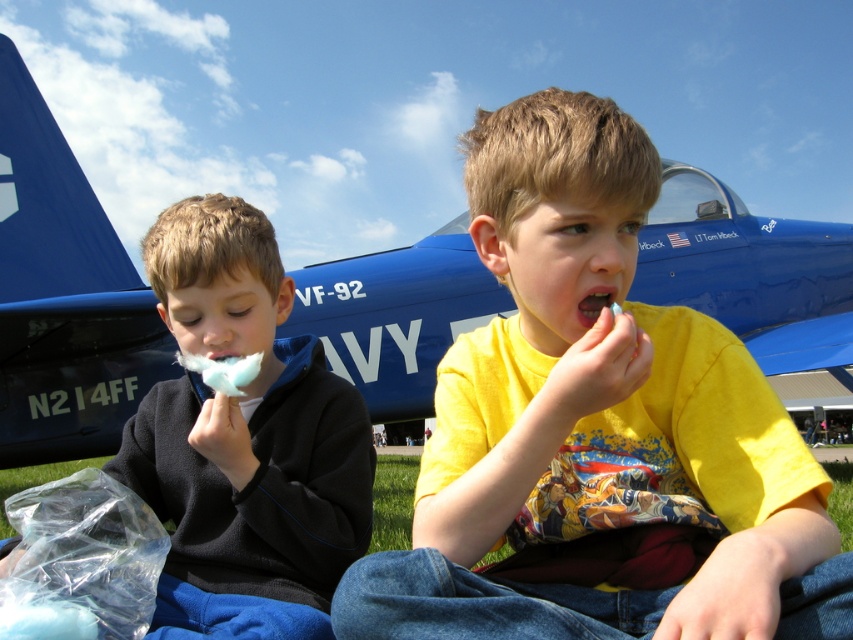
You are a photographer trying to capture a photo of the blue glossy airplane at center and the white fluffy cotton candy at left. From the perspective of the photographer, which object is located to the right?

The blue glossy airplane at center is positioned on the right side of the white fluffy cotton candy at left, so from the photographer perspective, the blue glossy airplane at center is to the right of the white fluffy cotton candy at left.

You are a photographer trying to capture a photo of the blue glossy airplane at center and the white fluffy cotton candy at left. If you want to ensure both objects are fully visible in your shot, which object should you focus on first to avoid cropping either?

The blue glossy airplane at center has a lesser width compared to white fluffy cotton candy at left, so you should focus on the white fluffy cotton candy at left first since it is wider and requires more space in the frame to avoid cropping.

You are a photographer trying to capture a closeup of the yellow cotton candy at center. The camera you are using has a focal length of 50mm. If the cotton candy is at point coordinates of 0.672 on the x axis and 0.702 on the y axis, what is the best way to position the camera to take a clear photo?

The yellow cotton candy at center is located at coordinates x 0.672 and y 0.702. To take a clear photo, position the camera directly facing the point at those coordinates with the focal length set to 50mm.